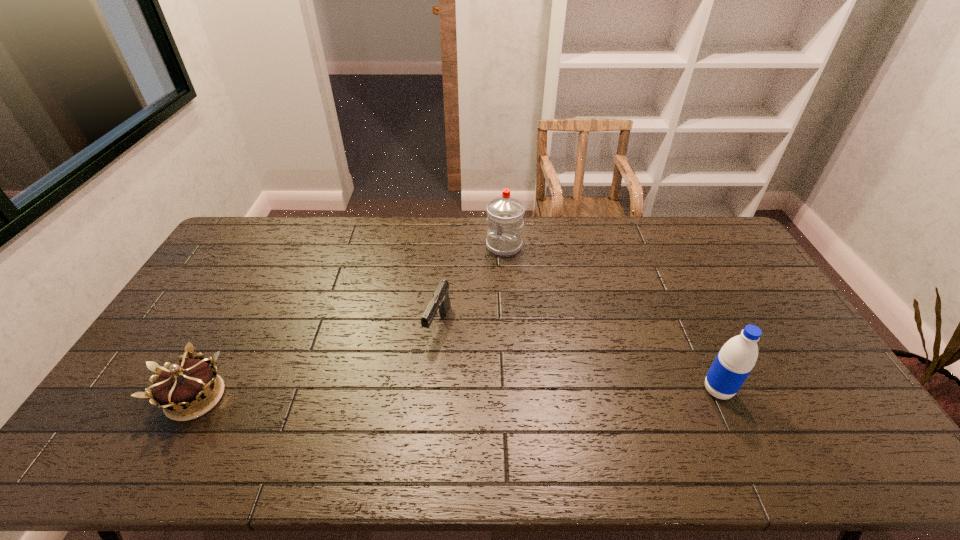
Where is `free space located 0.120m aim along the barrel of the third object from right to left`? This screenshot has height=540, width=960. free space located 0.120m aim along the barrel of the third object from right to left is located at coordinates (418, 381).

At what (x,y) coordinates should I click in order to perform the action: click on vacant space located aim along the barrel of the third object from right to left. Please return your answer as a coordinate pair (x, y). Looking at the image, I should click on (421, 372).

Identify the location of free space located on the handle side of the farther water bottle. The image size is (960, 540). (468, 303).

Locate an element on the screen. This screenshot has width=960, height=540. vacant area situated 0.160m on the handle side of the farther water bottle is located at coordinates (480, 284).

Where is `vacant region located on the handle side of the farther water bottle`? vacant region located on the handle side of the farther water bottle is located at coordinates (451, 329).

At what (x,y) coordinates should I click in order to perform the action: click on object located at the far edge. Please return your answer as a coordinate pair (x, y). Looking at the image, I should click on (505, 214).

You are a GUI agent. You are given a task and a screenshot of the screen. Output one action in this format:
    pyautogui.click(x=<x>, y=<y>)
    Task: Click on the crown that is at the near edge
    This screenshot has width=960, height=540.
    Given the screenshot: What is the action you would take?
    pyautogui.click(x=189, y=384)

The height and width of the screenshot is (540, 960). What are the coordinates of `water bottle located at the near edge` in the screenshot? It's located at (734, 362).

In order to click on object that is at the left edge in this screenshot , I will do `click(189, 384)`.

Locate an element on the screen. The height and width of the screenshot is (540, 960). object present at the near left corner is located at coordinates (189, 384).